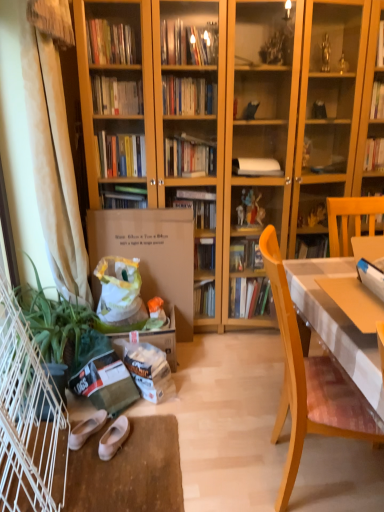
This screenshot has width=384, height=512. Describe the element at coordinates (113, 438) in the screenshot. I see `white leather shoes at lower center, which is the 2th footwear in left-to-right order` at that location.

Describe the element at coordinates (337, 323) in the screenshot. The height and width of the screenshot is (512, 384). I see `white cloth-covered desk at right` at that location.

Describe the element at coordinates (311, 383) in the screenshot. I see `wooden chair at right` at that location.

The height and width of the screenshot is (512, 384). Describe the element at coordinates (57, 378) in the screenshot. I see `black plastic flowerpot at lower left` at that location.

Identify the location of black plastic flowerpot at lower left. (57, 378).

The height and width of the screenshot is (512, 384). Describe the element at coordinates (105, 383) in the screenshot. I see `brown paper bag at lower left, the first paperback book in the front-to-back sequence` at that location.

This screenshot has height=512, width=384. I want to click on brown paper bag at lower left, placed as the second paperback book when sorted from top to bottom, so click(105, 383).

This screenshot has height=512, width=384. I want to click on white suede shoes at lower left, marked as the 2th footwear in a right-to-left arrangement, so [86, 429].

The height and width of the screenshot is (512, 384). Describe the element at coordinates (53, 161) in the screenshot. I see `white fabric curtain at left` at that location.

The image size is (384, 512). Find the location of `white leather shoes at lower center, which is the 2th footwear in left-to-right order`. white leather shoes at lower center, which is the 2th footwear in left-to-right order is located at coordinates (113, 438).

Can you confirm if green leafy plant at lower left is thinner than white suede shoes at lower left, the 1th footwear in the left-to-right sequence?

No.

Would you say green leafy plant at lower left is inside or outside white suede shoes at lower left, the 1th footwear in the left-to-right sequence?

green leafy plant at lower left exists outside the volume of white suede shoes at lower left, the 1th footwear in the left-to-right sequence.

From the image's perspective, relative to white suede shoes at lower left, the 1th footwear in the left-to-right sequence, is green leafy plant at lower left above or below?

Clearly, from the image's perspective, green leafy plant at lower left is above white suede shoes at lower left, the 1th footwear in the left-to-right sequence.

Is green leafy plant at lower left aimed at brown paper bag at lower left, the first paperback book in the front-to-back sequence?

No, green leafy plant at lower left is not facing towards brown paper bag at lower left, the first paperback book in the front-to-back sequence.

Looking at the image, does green leafy plant at lower left seem bigger or smaller compared to brown paper bag at lower left, which is the 1th paperback book in bottom-to-top order?

In the image, green leafy plant at lower left appears to be larger than brown paper bag at lower left, which is the 1th paperback book in bottom-to-top order.

Does green leafy plant at lower left touch brown paper bag at lower left, which is the 1th paperback book in bottom-to-top order?

No, green leafy plant at lower left is not beside brown paper bag at lower left, which is the 1th paperback book in bottom-to-top order.

Would you say green leafy plant at lower left is to the left or to the right of brown paper bag at lower left, positioned as the second paperback book in back-to-front order, in the picture?

Clearly, green leafy plant at lower left is on the left of brown paper bag at lower left, positioned as the second paperback book in back-to-front order, in the image.

Can we say wooden chair at right lies outside brown paper bag at lower left, which is the 1th paperback book in bottom-to-top order?

Yes, wooden chair at right is outside of brown paper bag at lower left, which is the 1th paperback book in bottom-to-top order.

From the image's perspective, between wooden chair at right and brown paper bag at lower left, positioned as the second paperback book in back-to-front order, who is located below?

From the image's view, brown paper bag at lower left, positioned as the second paperback book in back-to-front order, is below.

Which point is more forward, (333, 422) or (86, 375)?

The point (333, 422) is closer.

Find the location of a particular element. Image resolution: width=384 pixels, height=512 pixels. chair lying above the brown paper bag at lower left, positioned as the second paperback book in back-to-front order (from the image's perspective) is located at coordinates (311, 383).

Is black plastic flowerpot at lower left far away from matte cardboard box at center, the second paperback book viewed from the front?

No, black plastic flowerpot at lower left is not far away from matte cardboard box at center, the second paperback book viewed from the front.

From the image's perspective, between black plastic flowerpot at lower left and matte cardboard box at center, which is counted as the first paperback book, starting from the back, who is located below?

From the image's view, black plastic flowerpot at lower left is below.

Locate an element on the screen. flowerpot that appears in front of the matte cardboard box at center, acting as the 1th paperback book starting from the top is located at coordinates (57, 378).

Can you tell me how much black plastic flowerpot at lower left and matte cardboard box at center, placed as the 2th paperback book when sorted from bottom to top, differ in facing direction?

black plastic flowerpot at lower left and matte cardboard box at center, placed as the 2th paperback book when sorted from bottom to top, are facing 81.4 degrees away from each other.

Considering the sizes of objects white cloth-covered desk at right and white leather shoes at lower center, acting as the first footwear starting from the right, in the image provided, who is thinner, white cloth-covered desk at right or white leather shoes at lower center, acting as the first footwear starting from the right,?

Thinner between the two is white leather shoes at lower center, acting as the first footwear starting from the right.

From their relative heights in the image, would you say white cloth-covered desk at right is taller or shorter than white leather shoes at lower center, acting as the first footwear starting from the right?

In the image, white cloth-covered desk at right appears to be taller than white leather shoes at lower center, acting as the first footwear starting from the right.

Is point (356, 343) closer or farther from the camera than point (117, 426)?

Point (356, 343).

Considering the relative positions of white cloth-covered desk at right and white leather shoes at lower center, which is the 2th footwear in left-to-right order, in the image provided, is white cloth-covered desk at right to the right of white leather shoes at lower center, which is the 2th footwear in left-to-right order, from the viewer's perspective?

Correct, you'll find white cloth-covered desk at right to the right of white leather shoes at lower center, which is the 2th footwear in left-to-right order.

Which object is closer to the camera, wooden chair at right or matte cardboard box at center, which is counted as the first paperback book, starting from the back?

Positioned in front is wooden chair at right.

Are wooden chair at right and matte cardboard box at center, the second paperback book viewed from the front, located far from each other?

That's right, there is a large distance between wooden chair at right and matte cardboard box at center, the second paperback book viewed from the front.

From a real-world perspective, is wooden chair at right positioned above or below matte cardboard box at center, placed as the 2th paperback book when sorted from bottom to top?

wooden chair at right is above matte cardboard box at center, placed as the 2th paperback book when sorted from bottom to top.

Can you confirm if wooden chair at right is smaller than matte cardboard box at center, placed as the 2th paperback book when sorted from bottom to top?

Actually, wooden chair at right might be larger than matte cardboard box at center, placed as the 2th paperback book when sorted from bottom to top.

Measure the distance from wooden chair at right to white leather shoes at lower center, acting as the first footwear starting from the right.

wooden chair at right and white leather shoes at lower center, acting as the first footwear starting from the right, are 33.28 inches apart.

From the image's perspective, does wooden chair at right appear lower than white leather shoes at lower center, acting as the first footwear starting from the right?

No, from the image's perspective, wooden chair at right is not beneath white leather shoes at lower center, acting as the first footwear starting from the right.

Is wooden chair at right completely or partially outside of white leather shoes at lower center, which is the 2th footwear in left-to-right order?

Yes, wooden chair at right is outside of white leather shoes at lower center, which is the 2th footwear in left-to-right order.

Which of these two, wooden chair at right or white leather shoes at lower center, acting as the first footwear starting from the right, is wider?

Wider between the two is wooden chair at right.

Find the location of a particular element. the 2nd footwear below the green leafy plant at lower left (from a real-world perspective) is located at coordinates (86, 429).

This screenshot has height=512, width=384. What are the coordinates of `paperback book that is the 1st object to the right of the green leafy plant at lower left, starting at the anchor` in the screenshot? It's located at click(x=105, y=383).

When comparing their distances from white leather shoes at lower center, which is the 2th footwear in left-to-right order, does green leafy plant at lower left or white suede shoes at lower left, marked as the 2th footwear in a right-to-left arrangement, seem further?

Based on the image, green leafy plant at lower left appears to be further to white leather shoes at lower center, which is the 2th footwear in left-to-right order.

Looking at the image, which one is located closer to brown paper bag at lower left, placed as the second paperback book when sorted from top to bottom, white cloth-covered desk at right or black plastic flowerpot at lower left?

black plastic flowerpot at lower left is closer to brown paper bag at lower left, placed as the second paperback book when sorted from top to bottom.

When comparing their distances from white suede shoes at lower left, marked as the 2th footwear in a right-to-left arrangement, does white cloth-covered desk at right or green leafy plant at lower left seem closer?

Among the two, green leafy plant at lower left is located nearer to white suede shoes at lower left, marked as the 2th footwear in a right-to-left arrangement.

Looking at the image, which one is located closer to wooden chair at right, white cloth-covered desk at right or white suede shoes at lower left, the 1th footwear in the left-to-right sequence?

Among the two, white cloth-covered desk at right is located nearer to wooden chair at right.

Which object lies further to the anchor point black plastic flowerpot at lower left, matte cardboard box at center, placed as the 2th paperback book when sorted from bottom to top, or white cloth-covered desk at right?

Result: white cloth-covered desk at right.

When comparing their distances from black plastic flowerpot at lower left, does white leather shoes at lower center, acting as the first footwear starting from the right, or brown paper bag at lower left, positioned as the second paperback book in back-to-front order, seem closer?

The object closer to black plastic flowerpot at lower left is brown paper bag at lower left, positioned as the second paperback book in back-to-front order.

Estimate the real-world distances between objects in this image. Which object is closer to wooden chair at right, matte cardboard box at center, the second paperback book viewed from the front, or green leafy plant at lower left?

The object closer to wooden chair at right is matte cardboard box at center, the second paperback book viewed from the front.

Which object lies nearer to the anchor point wooden chair at right, green leafy plant at lower left or matte cardboard box at center, acting as the 1th paperback book starting from the top?

Based on the image, matte cardboard box at center, acting as the 1th paperback book starting from the top, appears to be nearer to wooden chair at right.

Where is `footwear located between brown paper bag at lower left, placed as the second paperback book when sorted from top to bottom, and wooden chair at right in the left-right direction`? Image resolution: width=384 pixels, height=512 pixels. footwear located between brown paper bag at lower left, placed as the second paperback book when sorted from top to bottom, and wooden chair at right in the left-right direction is located at coordinates (113, 438).

Image resolution: width=384 pixels, height=512 pixels. What are the coordinates of `curtain between black plastic flowerpot at lower left and wooden chair at right in the horizontal direction` in the screenshot? It's located at (53, 161).

Find the location of a particular element. chair between white fabric curtain at left and white suede shoes at lower left, the 1th footwear in the left-to-right sequence, in the up-down direction is located at coordinates (311, 383).

Image resolution: width=384 pixels, height=512 pixels. Find the location of `chair between white fabric curtain at left and white cloth-covered desk at right in the horizontal direction`. chair between white fabric curtain at left and white cloth-covered desk at right in the horizontal direction is located at coordinates (311, 383).